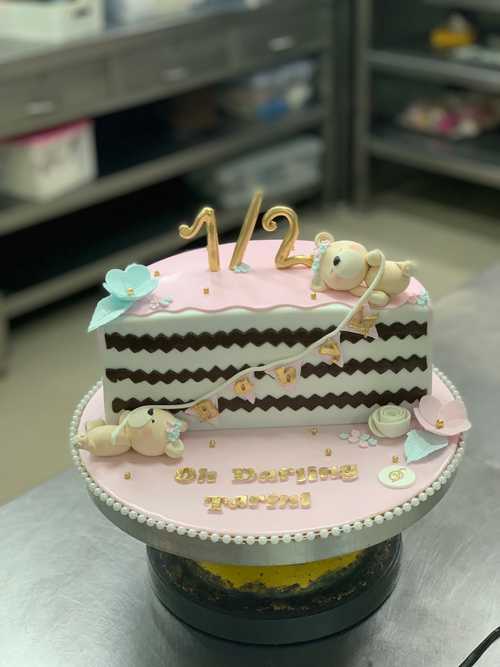
The width and height of the screenshot is (500, 667). Find the location of `teddy bear`. teddy bear is located at coordinates point(148,440), point(365,261).